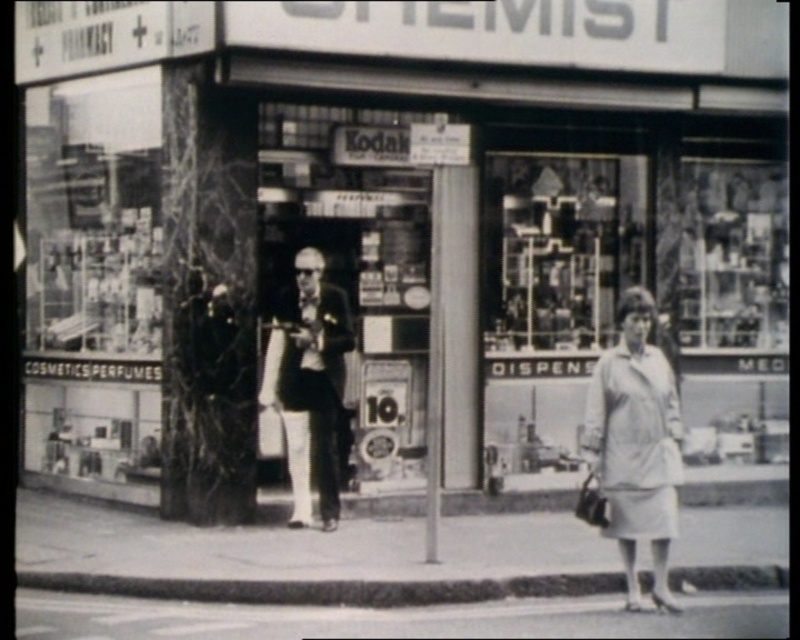
You are a customer entering the pharmacy and want to reach the items on the metallic glass shelves at center. Considering the smooth black suit at center is in your way, can you easily access the shelves?

The metallic glass shelves at center are not as tall as the smooth black suit at center, so the suit is blocking your access to the shelves. You may need to move the suit out of the way first.

You are standing in front of the pharmacy and see two points marked on the window. The first point is at position [580,170] and the second at [298,355]. Which point is closer to you?

Point [580,170] is further to the viewer than point [298,355], so the second point is closer to you.

You are a customer looking at the window display of the pharmacy. You see a light gray fabric coat at center and a smooth black suit at center. Which item is positioned lower in the display?

The light gray fabric coat at center is positioned below the smooth black suit at center, so it is lower in the display.